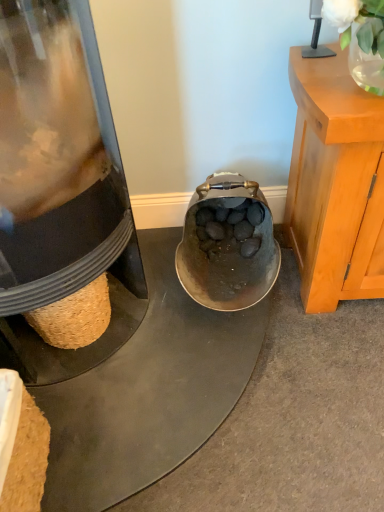
This screenshot has height=512, width=384. What do you see at coordinates (73, 249) in the screenshot? I see `matte black kettle at lower left` at bounding box center [73, 249].

This screenshot has width=384, height=512. I want to click on matte black kettle at lower left, so click(73, 249).

The image size is (384, 512). Identify the location of translucent glass vase at upper right. (361, 36).

Describe the element at coordinates (361, 36) in the screenshot. I see `translucent glass vase at upper right` at that location.

The width and height of the screenshot is (384, 512). I want to click on matte black kettle at lower left, so click(73, 249).

Visually, is matte black kettle at lower left positioned to the left or to the right of translucent glass vase at upper right?

matte black kettle at lower left is to the left of translucent glass vase at upper right.

Considering the relative positions of matte black kettle at lower left and translucent glass vase at upper right in the image provided, is matte black kettle at lower left behind translucent glass vase at upper right?

No, matte black kettle at lower left is in front of translucent glass vase at upper right.

Which point is more distant from viewer, (130, 332) or (365, 13)?

The point (130, 332) is farther from the camera.

From the image's perspective, which one is positioned lower, matte black kettle at lower left or translucent glass vase at upper right?

From the image's view, matte black kettle at lower left is below.

From a real-world perspective, is matte black kettle at lower left physically above translucent glass vase at upper right?

No, from a real-world perspective, matte black kettle at lower left is not above translucent glass vase at upper right.

In terms of width, does matte black kettle at lower left look wider or thinner when compared to translucent glass vase at upper right?

matte black kettle at lower left is wider than translucent glass vase at upper right.

Considering the relative sizes of matte black kettle at lower left and translucent glass vase at upper right in the image provided, is matte black kettle at lower left shorter than translucent glass vase at upper right?

Incorrect, the height of matte black kettle at lower left does not fall short of that of translucent glass vase at upper right.

Between matte black kettle at lower left and translucent glass vase at upper right, which one has larger size?

Bigger between the two is matte black kettle at lower left.

Is matte black kettle at lower left located outside translucent glass vase at upper right?

Yes, matte black kettle at lower left is located beyond the bounds of translucent glass vase at upper right.

Are matte black kettle at lower left and translucent glass vase at upper right far apart?

No, matte black kettle at lower left is not far from translucent glass vase at upper right.

Could you tell me if matte black kettle at lower left is facing translucent glass vase at upper right?

No.

Can you tell me how much matte black kettle at lower left and translucent glass vase at upper right differ in facing direction?

The facing directions of matte black kettle at lower left and translucent glass vase at upper right are 1.34 degrees apart.

In the image, there is a translucent glass vase at upper right. Identify the location of appliance below it (from a real-world perspective). This screenshot has width=384, height=512. (73, 249).

Which is more to the right, translucent glass vase at upper right or matte black kettle at lower left?

translucent glass vase at upper right is more to the right.

Is the depth of translucent glass vase at upper right greater than that of matte black kettle at lower left?

Yes, translucent glass vase at upper right is behind matte black kettle at lower left.

Which is nearer, (372, 55) or (111, 204)?

Point (372, 55) is closer to the camera than point (111, 204).

From the image's perspective, between translucent glass vase at upper right and matte black kettle at lower left, which one is located above?

From the image's view, translucent glass vase at upper right is above.

From a real-world perspective, is translucent glass vase at upper right positioned above or below matte black kettle at lower left?

From a real-world perspective, translucent glass vase at upper right is physically above matte black kettle at lower left.

Considering the sizes of objects translucent glass vase at upper right and matte black kettle at lower left in the image provided, who is wider, translucent glass vase at upper right or matte black kettle at lower left?

Wider between the two is matte black kettle at lower left.

Who is taller, translucent glass vase at upper right or matte black kettle at lower left?

matte black kettle at lower left.

Is translucent glass vase at upper right smaller than matte black kettle at lower left?

Correct, translucent glass vase at upper right occupies less space than matte black kettle at lower left.

From the picture: Is translucent glass vase at upper right inside or outside of matte black kettle at lower left?

translucent glass vase at upper right cannot be found inside matte black kettle at lower left.

Is translucent glass vase at upper right directly adjacent to matte black kettle at lower left?

No.

Is translucent glass vase at upper right oriented away from matte black kettle at lower left?

No, translucent glass vase at upper right is not facing away from matte black kettle at lower left.

How different are the orientations of translucent glass vase at upper right and matte black kettle at lower left in degrees?

The facing directions of translucent glass vase at upper right and matte black kettle at lower left are 1.34 degrees apart.

How far apart are translucent glass vase at upper right and matte black kettle at lower left?

A distance of 27.41 inches exists between translucent glass vase at upper right and matte black kettle at lower left.

This screenshot has height=512, width=384. Identify the location of appliance beneath the translucent glass vase at upper right (from a real-world perspective). (73, 249).

Locate an element on the screen. The height and width of the screenshot is (512, 384). appliance in front of the translucent glass vase at upper right is located at coordinates (73, 249).

You are a GUI agent. You are given a task and a screenshot of the screen. Output one action in this format:
    pyautogui.click(x=<x>, y=<y>)
    Task: Click on the plant located on the right of matte black kettle at lower left
    
    Given the screenshot: What is the action you would take?
    pyautogui.click(x=361, y=36)